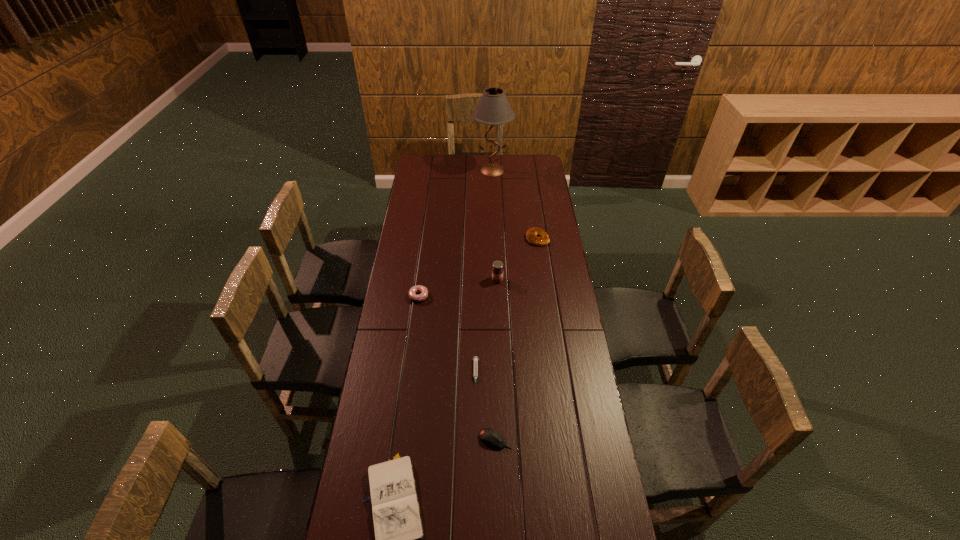
In the image, there is a desktop. At what (x,y) coordinates should I click in order to perform the action: click on vacant region at the left edge. Please return your answer as a coordinate pair (x, y). Looking at the image, I should click on (389, 313).

Locate an element on the screen. This screenshot has height=540, width=960. vacant space at the right edge of the desktop is located at coordinates (529, 202).

Where is `free space at the far right corner`? Image resolution: width=960 pixels, height=540 pixels. free space at the far right corner is located at coordinates (520, 165).

You are a GUI agent. You are given a task and a screenshot of the screen. Output one action in this format:
    pyautogui.click(x=<x>, y=<y>)
    Task: Click on the unoccupied position between the syringe and the computer mouse
    This screenshot has width=960, height=540.
    Given the screenshot: What is the action you would take?
    pyautogui.click(x=486, y=407)

What are the coordinates of `free space that is in between the second tallest object and the syringe` in the screenshot? It's located at (487, 327).

Where is `vacant space in between the bagel and the tallest object`? This screenshot has width=960, height=540. vacant space in between the bagel and the tallest object is located at coordinates (515, 205).

The image size is (960, 540). What are the coordinates of `free spot between the third nearest object and the fourth farthest object` in the screenshot? It's located at (447, 335).

Locate an element on the screen. The height and width of the screenshot is (540, 960). free space between the sixth shortest object and the table lamp is located at coordinates (494, 225).

Find the location of `free point between the bagel and the computer mouse`. free point between the bagel and the computer mouse is located at coordinates (516, 339).

Locate an element on the screen. object that is the third closest to the jam is located at coordinates (475, 365).